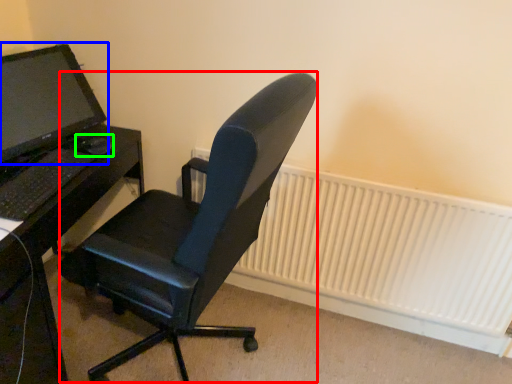
Question: Which is farther away from computer chair (highlighted by a red box)? computer monitor (highlighted by a blue box) or mouse (highlighted by a green box)?

Choices:
 (A) computer monitor
 (B) mouse

Answer: (A)